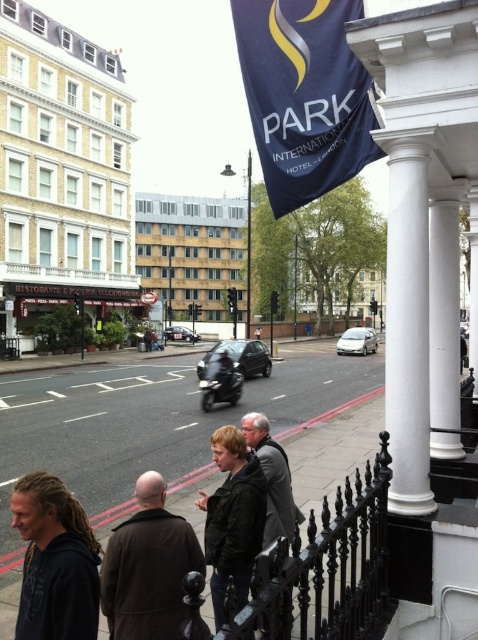
Based on the photo, who is more forward, (164, 387) or (246, 438)?

Point (246, 438) is more forward.

How distant is concrete sidewalk at lower center from dark gray jacket at center?

The distance of concrete sidewalk at lower center from dark gray jacket at center is 49.68 feet.

You are a GUI agent. You are given a task and a screenshot of the screen. Output one action in this format:
    pyautogui.click(x=<x>, y=<y>)
    Task: Click on the concrete sidewalk at lower center
    The image size is (478, 640).
    Given the screenshot: What is the action you would take?
    pyautogui.click(x=153, y=422)

Measure the distance from concrete sidewalk at lower center to dark brown hair at lower left.

They are 13.62 meters apart.

Does concrete sidewalk at lower center lie behind dark brown hair at lower left?

Yes, it is.

This screenshot has width=478, height=640. I want to click on concrete sidewalk at lower center, so click(x=153, y=422).

Based on the photo, which is below, brown leather coat at lower left or dark gray jacket at center?

brown leather coat at lower left

Is brown leather coat at lower left bigger than dark gray jacket at center?

Incorrect, brown leather coat at lower left is not larger than dark gray jacket at center.

This screenshot has width=478, height=640. Describe the element at coordinates (148, 566) in the screenshot. I see `brown leather coat at lower left` at that location.

Identify the location of brown leather coat at lower left. The height and width of the screenshot is (640, 478). (148, 566).